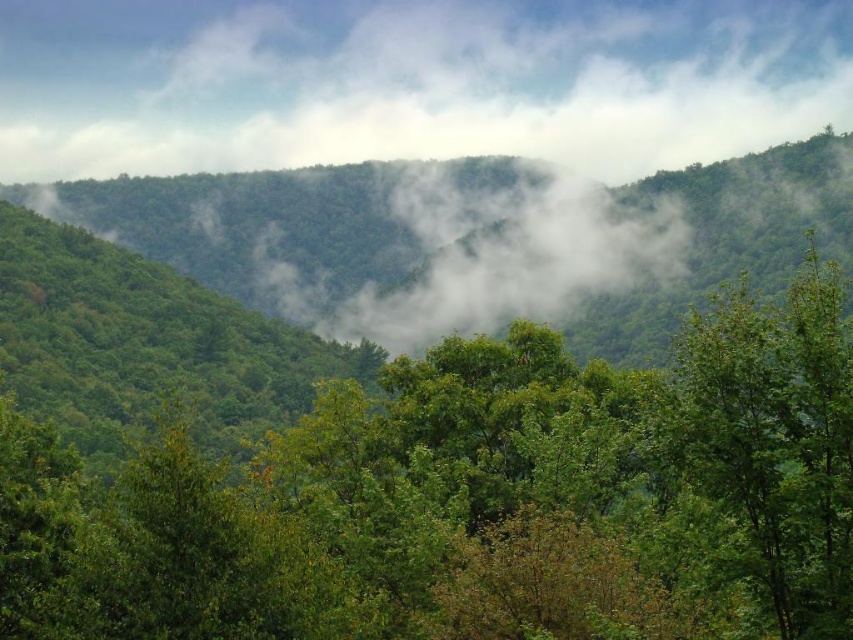
Between point (329, 83) and point (450, 179), which one is positioned in front?

Point (450, 179) is in front.

Based on the photo, is white misty cloud at upper center positioned in front of white fluffy cloud at center?

That is False.

Which is behind, point (734, 52) or point (503, 220)?

The point (734, 52) is more distant.

Find the location of a particular element. This screenshot has width=853, height=640. white misty cloud at upper center is located at coordinates (412, 83).

Who is lower down, green leafy tree at center or white fluffy cloud at center?

Positioned lower is green leafy tree at center.

Does green leafy tree at center appear on the left side of white fluffy cloud at center?

Yes, green leafy tree at center is to the left of white fluffy cloud at center.

Locate an element on the screen. This screenshot has width=853, height=640. green leafy tree at center is located at coordinates (474, 499).

Which is more to the left, green leafy tree at center or white misty cloud at upper center?

white misty cloud at upper center

Consider the image. Can you confirm if green leafy tree at center is positioned above white misty cloud at upper center?

No, green leafy tree at center is not above white misty cloud at upper center.

Which is behind, point (180, 545) or point (624, 120)?

The point (624, 120) is behind.

What are the coordinates of `green leafy tree at center` in the screenshot? It's located at (474, 499).